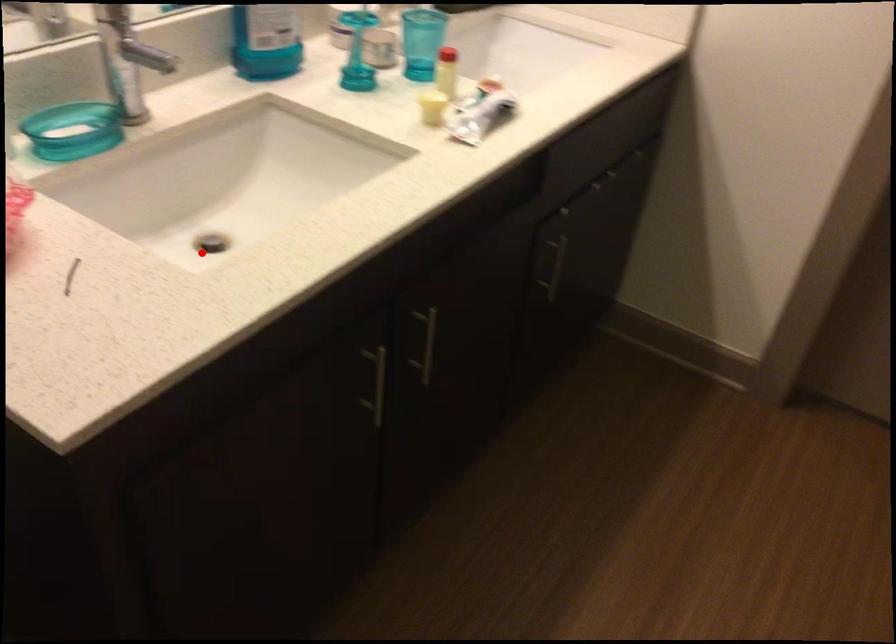
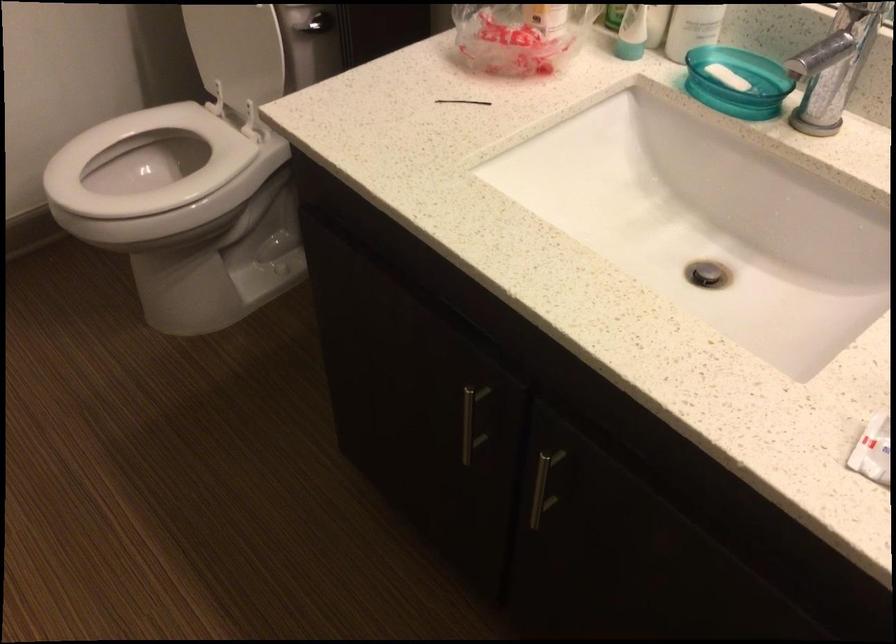
Question: I am providing you with two images of the same scene from different viewpoints. Image1 has a red point marked. In image2, the corresponding 3D location appears at what relative position? Reply with the corresponding letter.

Choices:
 (A) Closer
 (B) Farther

Answer: (A)